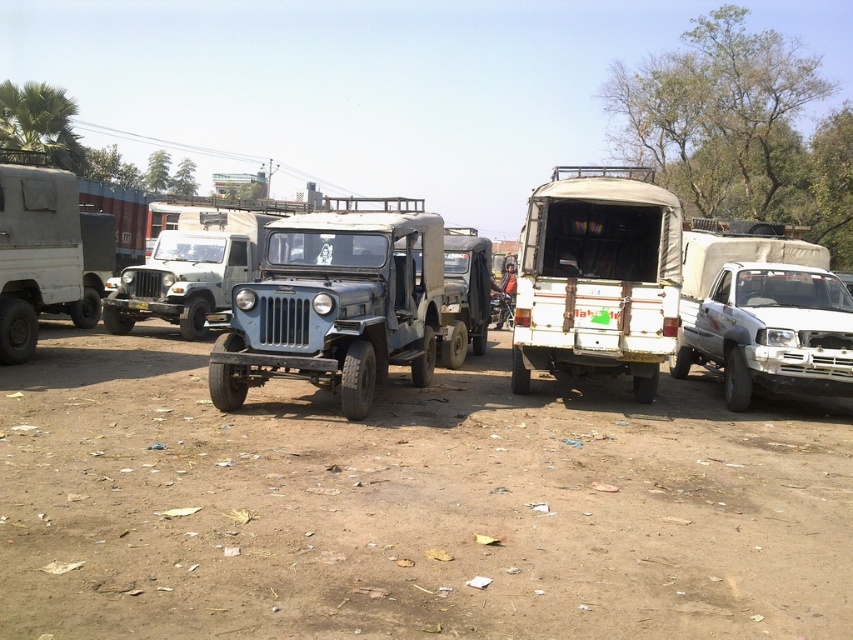
You are a photographer trying to capture a photo of the blue matte jeep at center and the white matte truck at right. If you want to ensure both vehicles are fully visible in the frame without any part being cut off, which vehicle should you position closer to the camera?

The blue matte jeep at center is thinner than the white matte truck at right. To ensure both are fully visible, position the blue matte jeep at center closer to the camera since its narrower width requires less space in the frame compared to the wider white matte truck at right.

You are a photographer setting up a tripod to capture the white matte truck at right and the dull brown dirt at center. Based on their positions, which object should you position your camera closer to if you want both subjects in the frame without moving the tripod?

You should position your camera closer to the dull brown dirt at center because it is to the left of the white matte truck at right, so centering the camera between them would require placing it nearer to the dull brown dirt at center to include both in the frame.